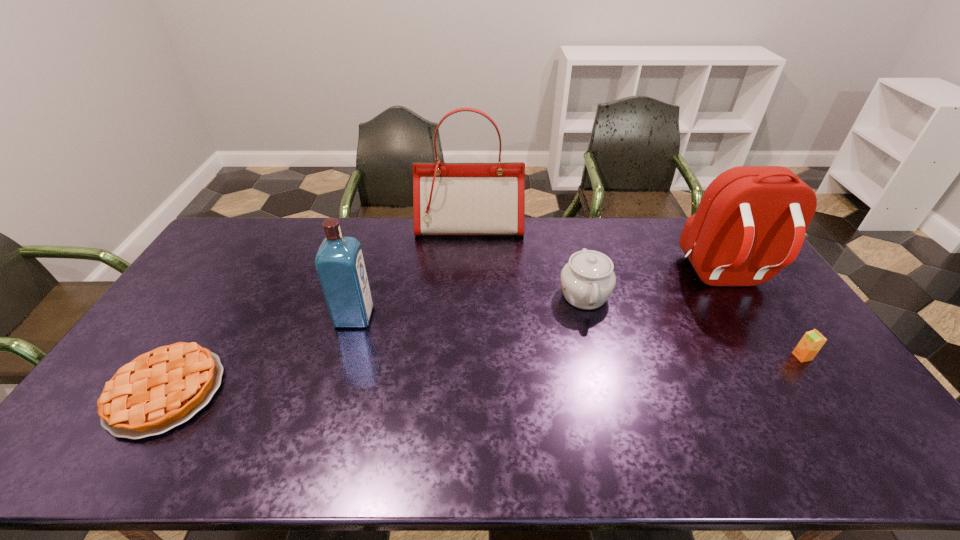
Where is `free space located 0.200m on the front of the handbag`? free space located 0.200m on the front of the handbag is located at coordinates (468, 273).

You are a GUI agent. You are given a task and a screenshot of the screen. Output one action in this format:
    pyautogui.click(x=<x>, y=<y>)
    Task: Click on the free spot located 0.340m on the strap side of the backpack
    The height and width of the screenshot is (540, 960).
    Given the screenshot: What is the action you would take?
    pyautogui.click(x=800, y=399)

Image resolution: width=960 pixels, height=540 pixels. What are the coordinates of `vacant space located on the flat label side of the liquor` in the screenshot? It's located at (444, 316).

The width and height of the screenshot is (960, 540). I want to click on free space located 0.090m on the right of the third object from right to left, so click(x=638, y=295).

Image resolution: width=960 pixels, height=540 pixels. What are the coordinates of `free spot located on the front of the orange juice` in the screenshot? It's located at (836, 407).

Locate an element on the screen. The image size is (960, 540). free space located 0.250m on the back of the shortest object is located at coordinates (229, 290).

Image resolution: width=960 pixels, height=540 pixels. I want to click on handbag that is positioned at the far edge, so click(x=448, y=198).

Image resolution: width=960 pixels, height=540 pixels. What are the coordinates of `backpack that is positioned at the far edge` in the screenshot? It's located at click(750, 223).

Find the location of a particular element. This screenshot has width=960, height=540. object present at the near edge is located at coordinates click(161, 389).

Image resolution: width=960 pixels, height=540 pixels. In order to click on object present at the left edge in this screenshot , I will do `click(161, 389)`.